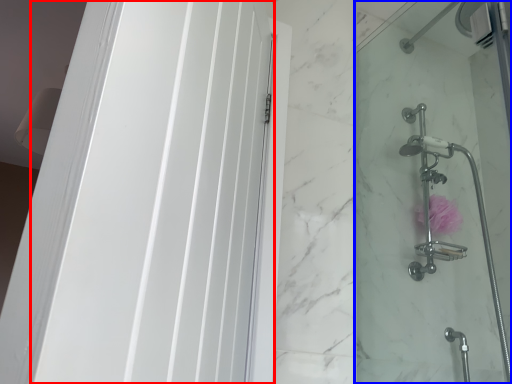
Question: Which point is further to the camera, screen door (highlighted by a red box) or shower door (highlighted by a blue box)?

Choices:
 (A) screen door
 (B) shower door

Answer: (B)